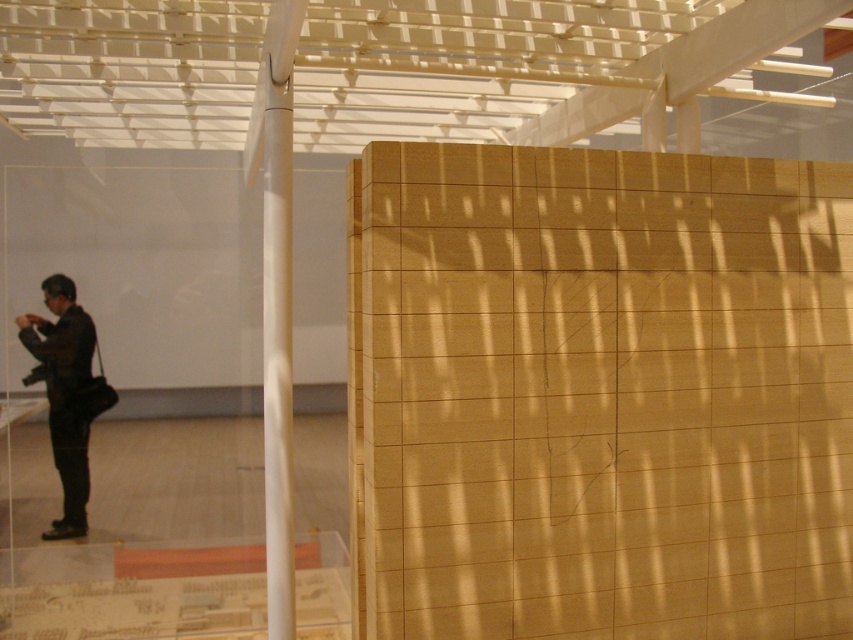
Question: Is white smooth pole at center to the left of black matte jacket at left from the viewer's perspective?

Choices:
 (A) no
 (B) yes

Answer: (A)

Question: Does white smooth pole at center have a lesser width compared to black matte jacket at left?

Choices:
 (A) yes
 (B) no

Answer: (B)

Question: Which object appears closest to the camera in this image?

Choices:
 (A) white smooth pole at center
 (B) black matte jacket at left

Answer: (A)

Question: Which object appears farthest from the camera in this image?

Choices:
 (A) white smooth pole at center
 (B) black matte jacket at left

Answer: (B)

Question: From the image, what is the correct spatial relationship of white smooth pole at center in relation to black matte jacket at left?

Choices:
 (A) below
 (B) above

Answer: (B)